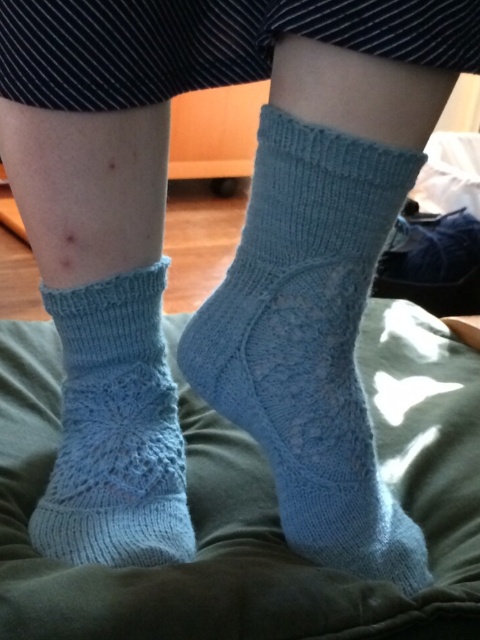
Who is positioned more to the left, light blue knitted socks at lower center or light blue knitted socks at center?

light blue knitted socks at lower center is more to the left.

Which is above, light blue knitted socks at lower center or light blue knitted socks at center?

light blue knitted socks at lower center is higher up.

The image size is (480, 640). What do you see at coordinates (101, 259) in the screenshot? I see `light blue knitted socks at lower center` at bounding box center [101, 259].

Where is `light blue knitted socks at lower center`? The height and width of the screenshot is (640, 480). light blue knitted socks at lower center is located at coordinates (101, 259).

Between light blue knitted socks at center and light blue knitted sock at lower left, which one is positioned higher?

light blue knitted socks at center is higher up.

Who is more distant from viewer, (297, 474) or (100, 451)?

Positioned behind is point (100, 451).

At what (x,y) coordinates should I click in order to perform the action: click on light blue knitted socks at center. Please return your answer as a coordinate pair (x, y). The image size is (480, 640). Looking at the image, I should click on click(x=311, y=340).

Consider the image. Who is shorter, light blue knitted socks at lower center or light blue knitted sock at lower left?

light blue knitted sock at lower left is shorter.

Does light blue knitted socks at lower center have a larger size compared to light blue knitted sock at lower left?

Yes.

In order to click on light blue knitted socks at lower center in this screenshot , I will do `click(101, 259)`.

I want to click on light blue knitted socks at lower center, so click(x=101, y=259).